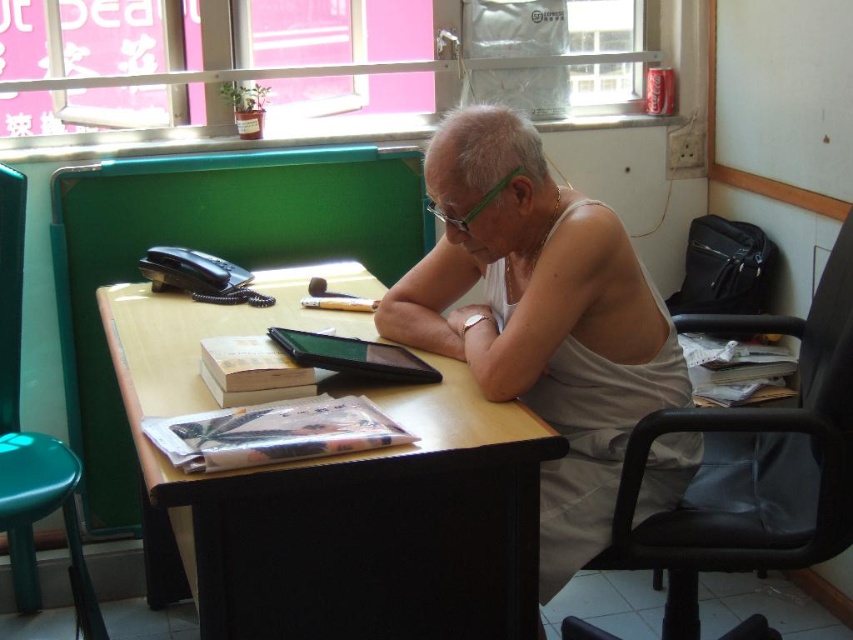
Question: Can you confirm if white cotton tank top at center is positioned below matte paper book at center?

Choices:
 (A) yes
 (B) no

Answer: (B)

Question: In this image, where is matte paper book at center located relative to black matte tablet at center?

Choices:
 (A) below
 (B) above

Answer: (A)

Question: Is wooden table at center wider than green plastic glasses at center?

Choices:
 (A) yes
 (B) no

Answer: (A)

Question: Which of the following is the farthest from the observer?

Choices:
 (A) wooden table at center
 (B) green plastic chair at lower left

Answer: (B)

Question: Among these objects, which one is farthest from the camera?

Choices:
 (A) wooden table at center
 (B) white cotton tank top at center
 (C) black matte tablet at center
 (D) matte paper book at center

Answer: (C)

Question: Which of the following is the closest to the observer?

Choices:
 (A) (213, 456)
 (B) (819, 305)
 (C) (252, 582)
 (D) (16, 224)

Answer: (A)